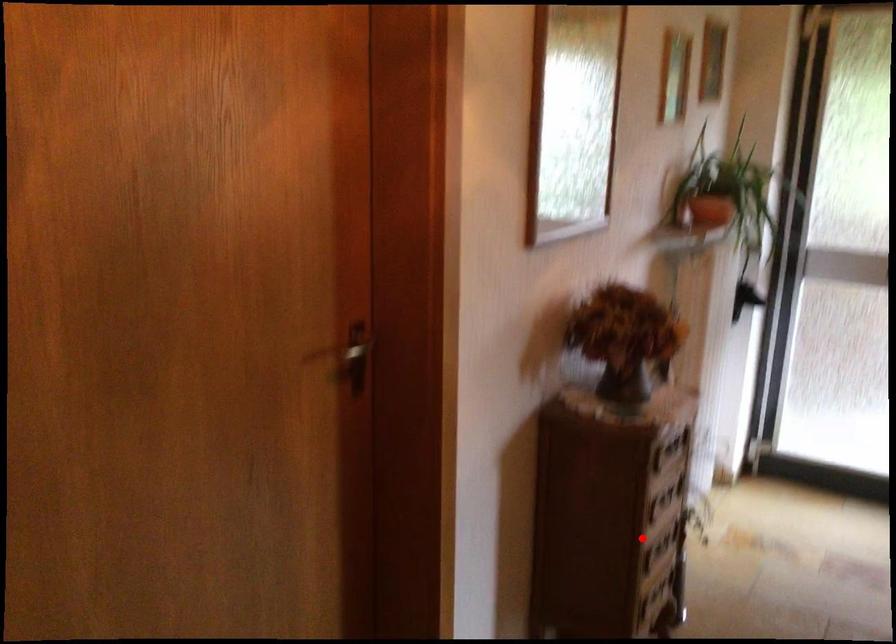
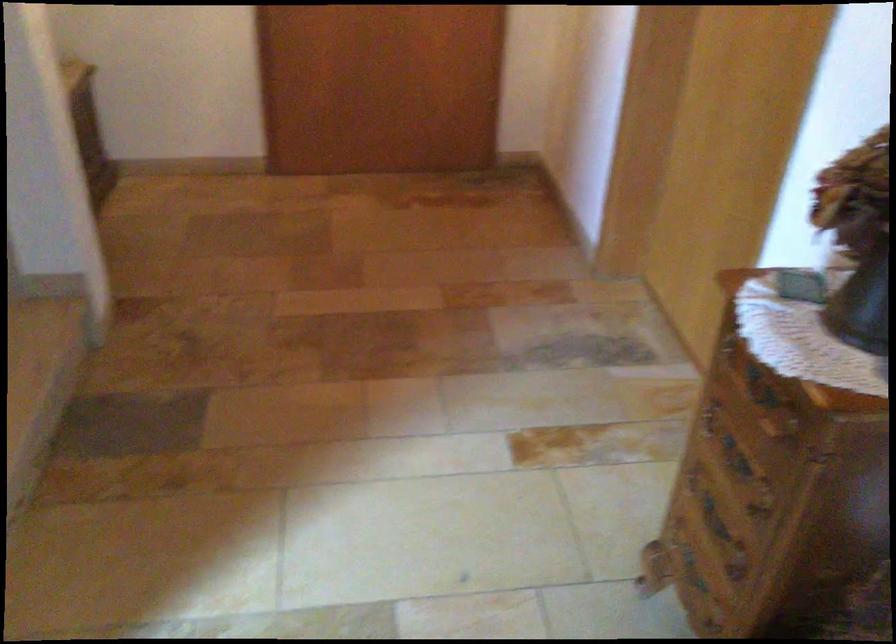
Question: I am providing you with two images of the same scene from different viewpoints. A red point is shown in image1. For the corresponding object point in image2, is it positioned nearer or farther from the camera?

Choices:
 (A) Nearer
 (B) Farther

Answer: (A)